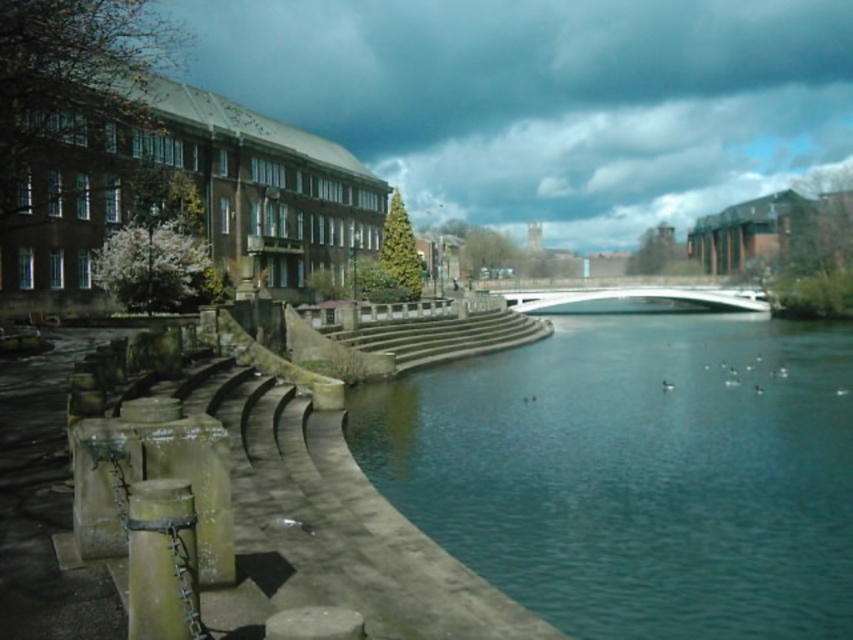
Question: Considering the real-world distances, which object is farthest from the white smooth bridge at center?

Choices:
 (A) teal concrete river at center
 (B) green weathered wood post at lower left

Answer: (B)

Question: Is teal concrete river at center smaller than green weathered wood post at lower left?

Choices:
 (A) no
 (B) yes

Answer: (A)

Question: Does teal concrete river at center appear on the right side of white smooth bridge at center?

Choices:
 (A) yes
 (B) no

Answer: (B)

Question: Which point is closer to the camera taking this photo?

Choices:
 (A) (555, 529)
 (B) (515, 305)
 (C) (189, 621)

Answer: (C)

Question: Which of these objects is positioned closest to the white smooth bridge at center?

Choices:
 (A) teal concrete river at center
 (B) green weathered wood post at lower left

Answer: (A)

Question: Can you confirm if teal concrete river at center is positioned to the right of white smooth bridge at center?

Choices:
 (A) no
 (B) yes

Answer: (A)